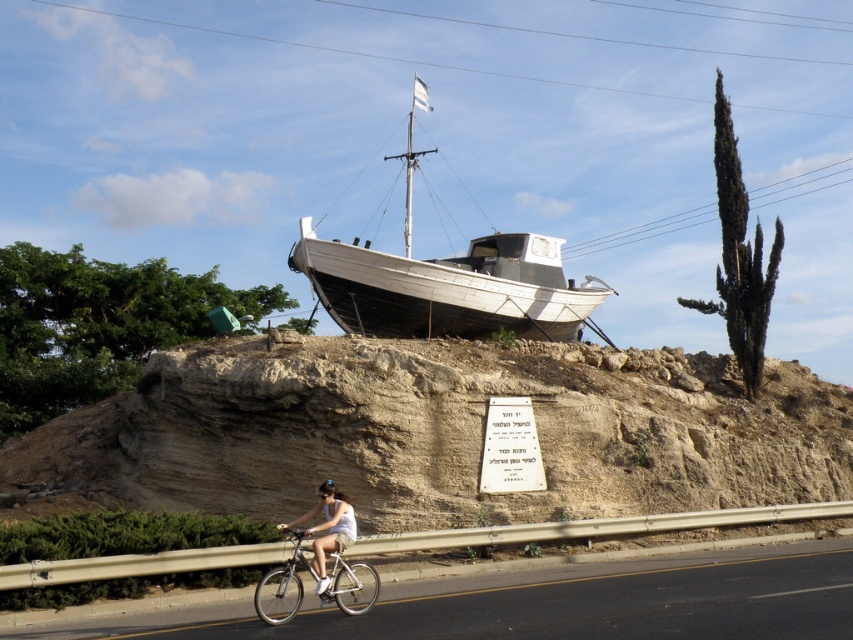
Is point (732, 609) behind point (424, 109)?

No, it is not.

Is black asphalt road at lower center smaller than white matte boat at center?

Indeed, black asphalt road at lower center has a smaller size compared to white matte boat at center.

Does point (492, 616) come behind point (544, 264)?

No, it is not.

I want to click on black asphalt road at lower center, so click(x=556, y=604).

What do you see at coordinates (442, 433) in the screenshot?
I see `brown sandy hillside at center` at bounding box center [442, 433].

Which is below, brown sandy hillside at center or white cotton dress at lower center?

white cotton dress at lower center

At what (x,y) coordinates should I click in order to perform the action: click on brown sandy hillside at center. Please return your answer as a coordinate pair (x, y). Looking at the image, I should click on 442,433.

The height and width of the screenshot is (640, 853). Find the location of `brown sandy hillside at center`. brown sandy hillside at center is located at coordinates (442, 433).

Does silver metallic bicycle at lower center have a lesser height compared to white cotton dress at lower center?

Yes.

In the scene shown: Is the position of silver metallic bicycle at lower center less distant than that of white cotton dress at lower center?

No, silver metallic bicycle at lower center is behind white cotton dress at lower center.

Which is in front, point (360, 572) or point (332, 502)?

Point (332, 502)

The width and height of the screenshot is (853, 640). Find the location of `silver metallic bicycle at lower center`. silver metallic bicycle at lower center is located at coordinates (283, 584).